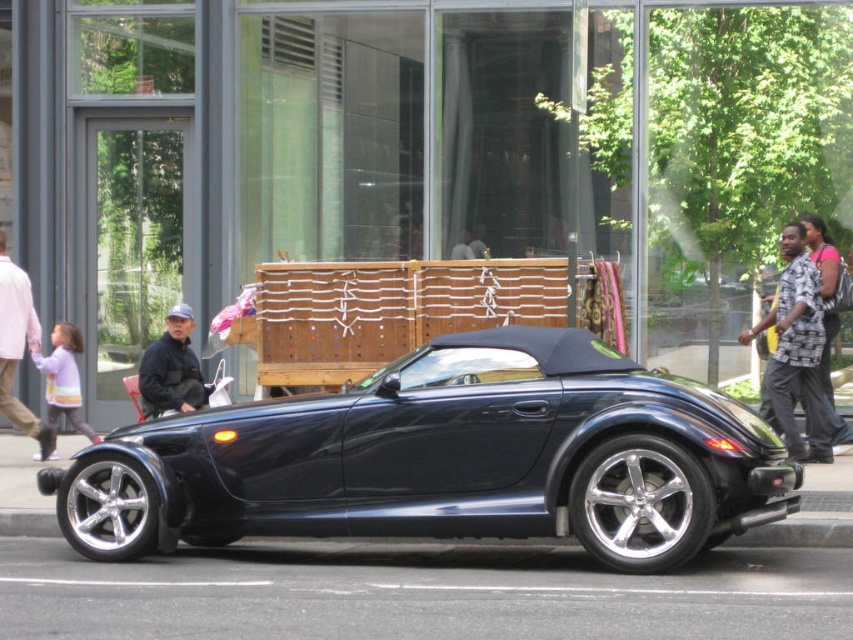
You are standing at the point with coordinates point (62, 403) and want to walk to the point with coordinates point (10, 362). Which direction should you move relative to your current position?

You should move forward because point (10, 362) is in front of point (62, 403).

You are a customer looking at two items displayed on a rack. The items are the light pink shirt at left and the light purple sweater at left. Which one is positioned more to the left?

The light pink shirt at left is positioned more to the left than the light purple sweater at left.